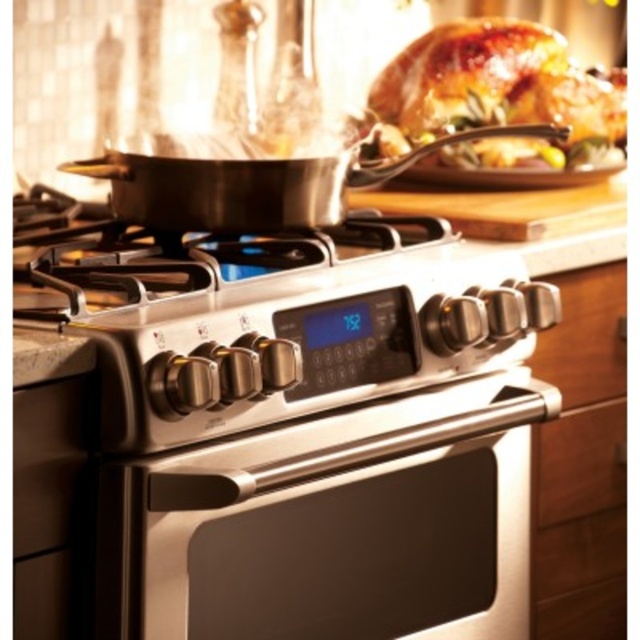
Question: Which point is closer to the camera?

Choices:
 (A) (234, 257)
 (B) (563, 113)
 (C) (252, 269)

Answer: (A)

Question: Considering the real-world distances, which object is closest to the satin nickel oven at center?

Choices:
 (A) shiny silver frying pan at upper center
 (B) satin nickel gas stove at center
 (C) stainless steel gas stove at center

Answer: (C)

Question: Where is golden-brown roasted chicken at upper right located in relation to satin nickel gas stove at center in the image?

Choices:
 (A) below
 (B) above

Answer: (B)

Question: Which object is closer to the camera taking this photo?

Choices:
 (A) stainless steel gas stove at center
 (B) golden-brown roasted chicken at upper right
 (C) satin nickel gas stove at center

Answer: (A)

Question: Can you confirm if stainless steel gas stove at center is bigger than shiny silver frying pan at upper center?

Choices:
 (A) no
 (B) yes

Answer: (B)

Question: In this image, where is stainless steel gas stove at center located relative to shiny silver frying pan at upper center?

Choices:
 (A) left
 (B) right

Answer: (A)